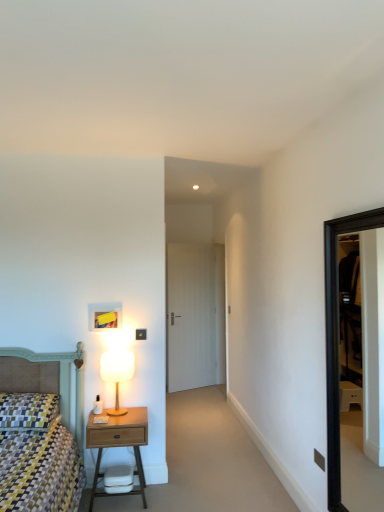
What do you see at coordinates (319, 459) in the screenshot?
I see `matte black switch at upper center` at bounding box center [319, 459].

The width and height of the screenshot is (384, 512). Find the location of `matte black switch at upper center`. matte black switch at upper center is located at coordinates (319, 459).

The image size is (384, 512). What do you see at coordinates (336, 339) in the screenshot?
I see `black frame door at right` at bounding box center [336, 339].

Find the location of a particular element. This screenshot has height=512, width=384. patterned fabric pillow at lower left is located at coordinates (28, 410).

Locate an element on the screen. matte black switch at upper center is located at coordinates (319, 459).

Is wooden nightstand at lower left positioned beyond the bounds of matte black switch at upper center?

Yes, wooden nightstand at lower left is located beyond the bounds of matte black switch at upper center.

From the image's perspective, does wooden nightstand at lower left appear lower than matte black switch at upper center?

Indeed, from the image's perspective, wooden nightstand at lower left is shown beneath matte black switch at upper center.

Considering the sizes of wooden nightstand at lower left and matte black switch at upper center in the image, is wooden nightstand at lower left taller or shorter than matte black switch at upper center?

Answer: Clearly, wooden nightstand at lower left is taller compared to matte black switch at upper center.

Is point (88, 426) positioned after point (320, 461)?

Yes, point (88, 426) is farther from viewer.

Find the location of `table lamp lying on the right of patterned fabric pillow at lower left`. table lamp lying on the right of patterned fabric pillow at lower left is located at coordinates (117, 373).

From the picture: From the image's perspective, is patterned fabric pillow at lower left over matte white lamp at left?

No, from the image's perspective, patterned fabric pillow at lower left is not over matte white lamp at left.

Considering the relative sizes of patterned fabric pillow at lower left and matte white lamp at left in the image provided, is patterned fabric pillow at lower left thinner than matte white lamp at left?

Incorrect, the width of patterned fabric pillow at lower left is not less than that of matte white lamp at left.

In the scene shown: Considering the relative sizes of patterned fabric pillow at lower left and matte white lamp at left in the image provided, is patterned fabric pillow at lower left shorter than matte white lamp at left?

Indeed, patterned fabric pillow at lower left has a lesser height compared to matte white lamp at left.

Consider the image. From the image's perspective, is patterned fabric pillow at lower left positioned above or below matte black switch at upper center?

patterned fabric pillow at lower left is above matte black switch at upper center.

Which is closer to the camera, [28,413] or [317,461]?

The point [317,461] is in front.

Does patterned fabric pillow at lower left have a greater height compared to matte black switch at upper center?

Indeed, patterned fabric pillow at lower left has a greater height compared to matte black switch at upper center.

Is patterned fabric pillow at lower left completely or partially outside of matte black switch at upper center?

Yes, patterned fabric pillow at lower left is located beyond the bounds of matte black switch at upper center.

Which of these two, black frame door at right or matte white lamp at left, is smaller?

Smaller between the two is matte white lamp at left.

Between black frame door at right and matte white lamp at left, which one appears on the right side from the viewer's perspective?

Positioned to the right is black frame door at right.

From the image's perspective, would you say black frame door at right is positioned over matte white lamp at left?

Yes, from the image's perspective, black frame door at right is over matte white lamp at left.

Is black frame door at right surrounding matte black switch at upper center?

No.

Is point (330, 265) positioned in front of point (323, 462)?

No, (330, 265) is behind (323, 462).

Is black frame door at right placed right next to matte black switch at upper center?

No.

Considering the relative sizes of patterned fabric pillow at lower left and white wood door at center in the image provided, is patterned fabric pillow at lower left taller than white wood door at center?

Incorrect, the height of patterned fabric pillow at lower left is not larger of that of white wood door at center.

Which of these two, patterned fabric pillow at lower left or white wood door at center, is smaller?

Smaller between the two is patterned fabric pillow at lower left.

Locate an element on the screen. door to the right of patterned fabric pillow at lower left is located at coordinates (195, 316).

Which object is positioned more to the right, patterned fabric pillow at lower left or white wood door at center?

white wood door at center is more to the right.

Consider the image. From a real-world perspective, between black frame door at right and wooden nightstand at lower left, who is vertically lower?

In real-world perspective, wooden nightstand at lower left is lower.

Is point (327, 445) farther from viewer compared to point (93, 417)?

No.

Looking at the image, does black frame door at right seem bigger or smaller compared to wooden nightstand at lower left?

black frame door at right is smaller than wooden nightstand at lower left.

Identify the location of nightstand that is under the matte black switch at upper center (from a real-world perspective). The height and width of the screenshot is (512, 384). (119, 443).

Where is `pillow on the left of matte white lamp at left`? The height and width of the screenshot is (512, 384). pillow on the left of matte white lamp at left is located at coordinates (28, 410).

From the image, which object appears to be nearer to matte white lamp at left, black frame door at right or white wood door at center?

Among the two, black frame door at right is located nearer to matte white lamp at left.

Based on their spatial positions, is black frame door at right or matte white lamp at left closer to wooden nightstand at lower left?

The object closer to wooden nightstand at lower left is matte white lamp at left.

Estimate the real-world distances between objects in this image. Which object is closer to matte white lamp at left, matte black switch at upper center or white wood door at center?

Among the two, matte black switch at upper center is located nearer to matte white lamp at left.

Based on their spatial positions, is matte white lamp at left or wooden nightstand at lower left closer to black frame door at right?

wooden nightstand at lower left is closer to black frame door at right.

In the scene shown: From the image, which object appears to be farther from patterned fabric pillow at lower left, wooden nightstand at lower left or matte white lamp at left?

matte white lamp at left is further to patterned fabric pillow at lower left.

Based on the photo, looking at the image, which one is located further to matte black switch at upper center, wooden nightstand at lower left or white wood door at center?

white wood door at center lies further to matte black switch at upper center than the other object.

Looking at this image, considering their positions, is matte black switch at upper center positioned further to patterned fabric pillow at lower left than wooden nightstand at lower left?

matte black switch at upper center.

In the scene shown: When comparing their distances from matte white lamp at left, does black frame door at right or patterned fabric pillow at lower left seem closer?

Based on the image, patterned fabric pillow at lower left appears to be nearer to matte white lamp at left.

You are a GUI agent. You are given a task and a screenshot of the screen. Output one action in this format:
    pyautogui.click(x=<x>, y=<y>)
    Task: Click on the table lamp between black frame door at right and white wood door at center from front to back
    
    Given the screenshot: What is the action you would take?
    pyautogui.click(x=117, y=373)

The height and width of the screenshot is (512, 384). I want to click on nightstand located between black frame door at right and white wood door at center in the depth direction, so click(119, 443).

Where is `pillow positioned between matte black switch at upper center and white wood door at center from near to far`? pillow positioned between matte black switch at upper center and white wood door at center from near to far is located at coordinates (28, 410).

Locate an element on the screen. This screenshot has width=384, height=512. nightstand between matte white lamp at left and matte black switch at upper center is located at coordinates (119, 443).